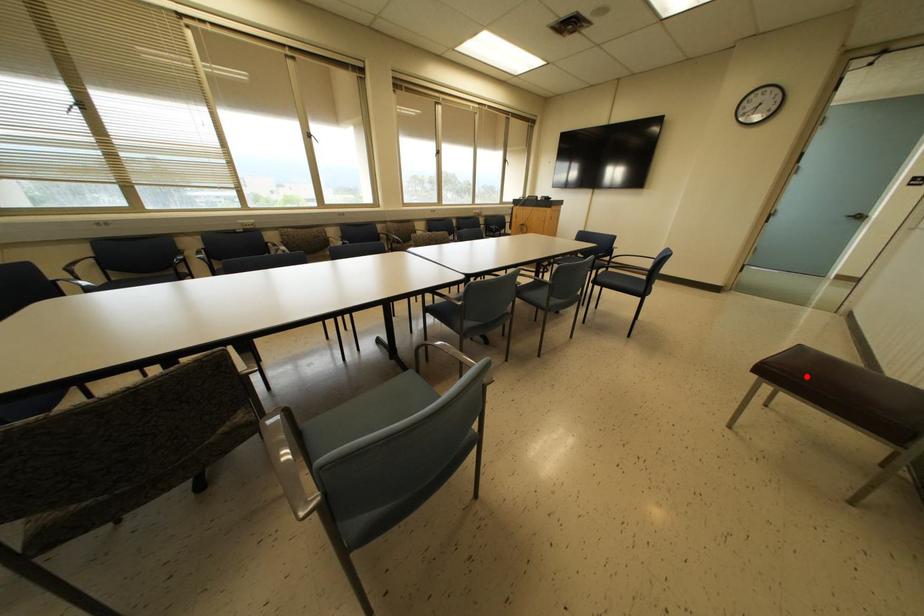
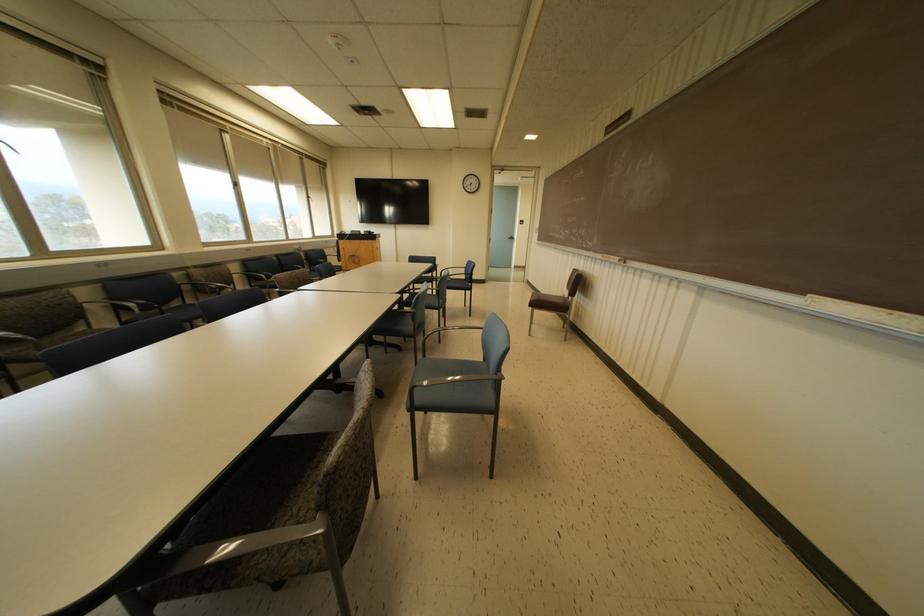
In the second image, find the point that corresponds to the highlighted location in the first image.

(540, 302)